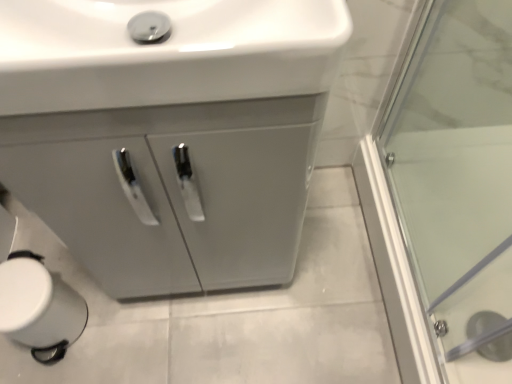
Question: From the image's perspective, is white glossy sink at upper center below matte gray cabinet at center?

Choices:
 (A) yes
 (B) no

Answer: (B)

Question: Is white glossy sink at upper center outside of matte gray cabinet at center?

Choices:
 (A) no
 (B) yes

Answer: (A)

Question: Is white glossy sink at upper center positioned far away from matte gray cabinet at center?

Choices:
 (A) yes
 (B) no

Answer: (B)

Question: Does white glossy sink at upper center turn towards matte gray cabinet at center?

Choices:
 (A) yes
 (B) no

Answer: (B)

Question: From the image's perspective, is white glossy sink at upper center on matte gray cabinet at center?

Choices:
 (A) yes
 (B) no

Answer: (A)

Question: Is white glossy sink at upper center thinner than matte gray cabinet at center?

Choices:
 (A) no
 (B) yes

Answer: (B)

Question: Can you confirm if matte gray cabinet at center is wider than white glossy sink at upper center?

Choices:
 (A) yes
 (B) no

Answer: (A)

Question: Is matte gray cabinet at center not within white glossy sink at upper center?

Choices:
 (A) no
 (B) yes

Answer: (B)

Question: Does matte gray cabinet at center have a larger size compared to white glossy sink at upper center?

Choices:
 (A) no
 (B) yes

Answer: (B)

Question: Is matte gray cabinet at center next to white glossy sink at upper center and touching it?

Choices:
 (A) no
 (B) yes

Answer: (A)

Question: Is matte gray cabinet at center not near white glossy sink at upper center?

Choices:
 (A) no
 (B) yes

Answer: (A)

Question: Is matte gray cabinet at center at the right side of white glossy sink at upper center?

Choices:
 (A) yes
 (B) no

Answer: (A)

Question: Relative to matte gray cabinet at center, is white glossy sink at upper center in front or behind?

Choices:
 (A) front
 (B) behind

Answer: (A)